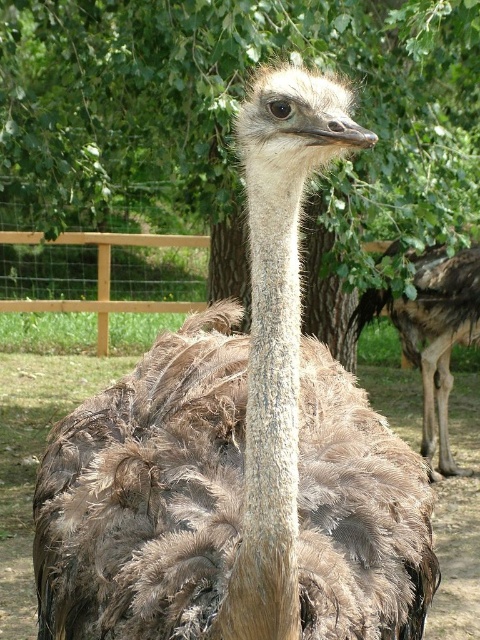
You are a photographer trying to capture a clear photo of the brown feathered ostrich at center. However, the green leafy tree at center is blocking your view. Can you move to the side to get a better shot without the tree blocking the ostrich?

The green leafy tree at center is in front of the brown feathered ostrich at center, so moving to the side might allow you to position yourself where the tree is no longer blocking the ostrich, providing a clearer view.

You are standing in a zoo enclosure and see the green leafy tree at center and the brown feathered ostrich at center. Which object is positioned to the left of the other?

The green leafy tree at center is to the left of the brown feathered ostrich at center.